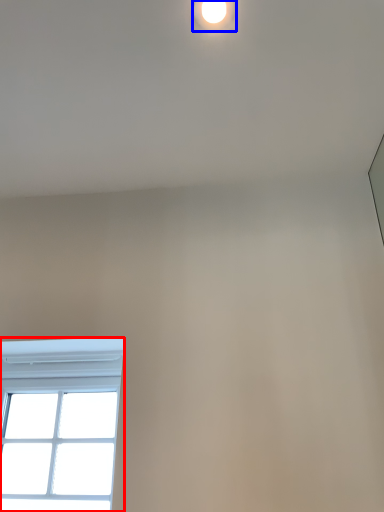
Question: Which of the following is the closest to the observer, window (highlighted by a red box) or droplight (highlighted by a blue box)?

Choices:
 (A) window
 (B) droplight

Answer: (B)